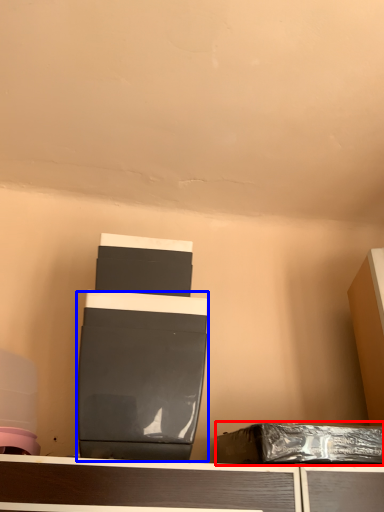
Question: Which object is further to the camera taking this photo, waste (highlighted by a red box) or wide (highlighted by a blue box)?

Choices:
 (A) waste
 (B) wide

Answer: (A)